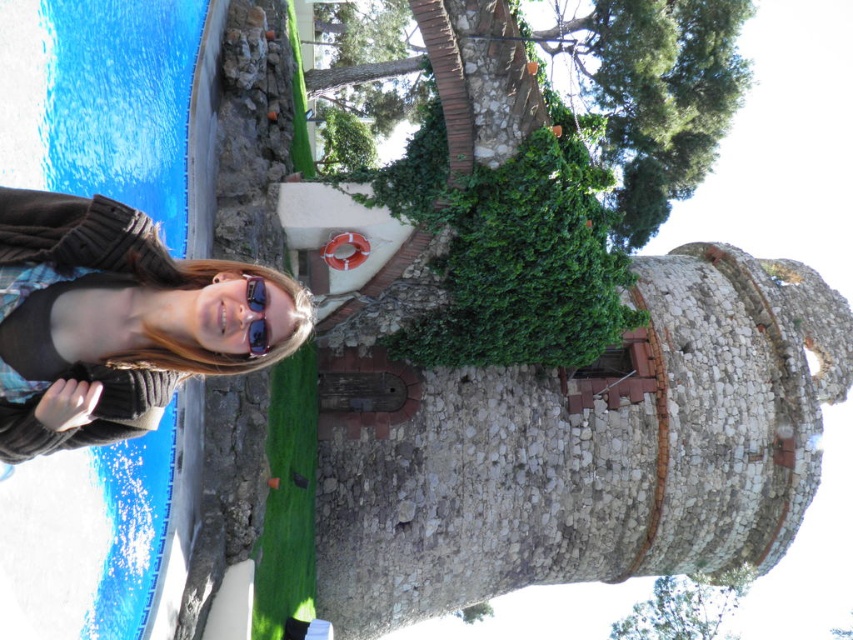
Question: Which object is farther from the camera taking this photo?

Choices:
 (A) matte black sunglasses at upper left
 (B) green leafy tree at upper center
 (C) green leafy tree trunk at upper center
 (D) blue glossy pool at lower left

Answer: (B)

Question: Can you confirm if matte brown sweater at lower left is positioned above green ivy-covered wall at upper center?

Choices:
 (A) yes
 (B) no

Answer: (B)

Question: Which of the following is the farthest from the observer?

Choices:
 (A) green leafy tree trunk at center
 (B) green leafy tree at upper center
 (C) green ivy-covered wall at upper center
 (D) sunglasses at center

Answer: (B)

Question: Estimate the real-world distances between objects in this image. Which object is farther from the green leafy tree trunk at center?

Choices:
 (A) green leafy tree at upper center
 (B) matte brown sweater at lower left
 (C) blue glossy pool at lower left

Answer: (B)

Question: Is matte black sunglasses at upper left bigger than green leafy tree at upper center?

Choices:
 (A) no
 (B) yes

Answer: (A)

Question: Does matte brown sweater at lower left have a larger size compared to matte black sunglasses at upper left?

Choices:
 (A) yes
 (B) no

Answer: (A)